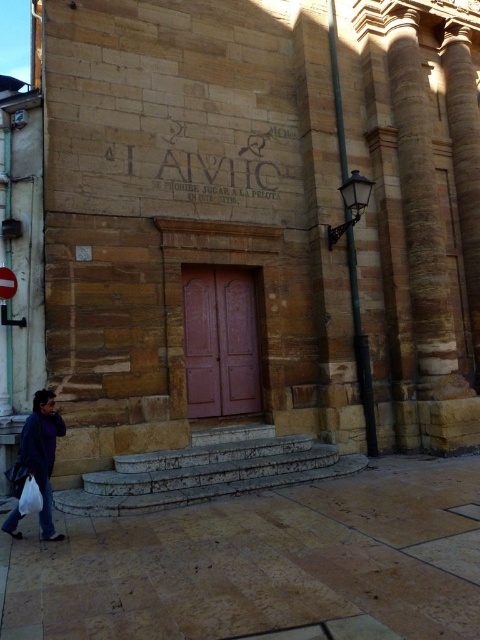
Question: Which object appears closest to the camera in this image?

Choices:
 (A) white plastic bag at lower left
 (B) metallic street sign at lower left
 (C) stone engraving at center

Answer: (A)

Question: Which of the following is the closest to the observer?

Choices:
 (A) stone engraving at center
 (B) metallic street sign at lower left
 (C) brown stone pavement at lower center

Answer: (C)

Question: Does brown stone pavement at lower center have a greater width compared to stone engraving at center?

Choices:
 (A) no
 (B) yes

Answer: (B)

Question: Does denim jacket at lower left come in front of white plastic bag at lower left?

Choices:
 (A) yes
 (B) no

Answer: (B)

Question: Among these points, which one is farthest from the camera?

Choices:
 (A) (230, 163)
 (B) (4, 292)
 (C) (39, 497)

Answer: (A)

Question: Can you confirm if brown stone pavement at lower center is thinner than stone engraving at center?

Choices:
 (A) no
 (B) yes

Answer: (A)